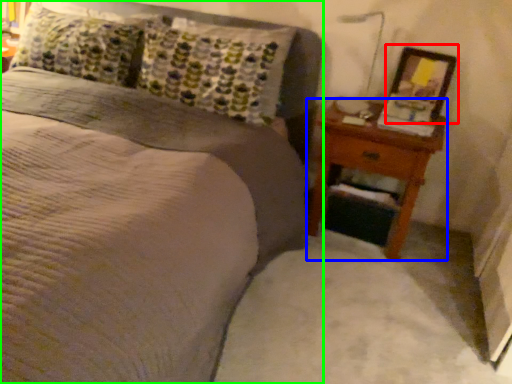
Question: Which object is positioned farthest from picture frame (highlighted by a red box)? Select from nightstand (highlighted by a blue box) and bed (highlighted by a green box).

Choices:
 (A) nightstand
 (B) bed

Answer: (B)